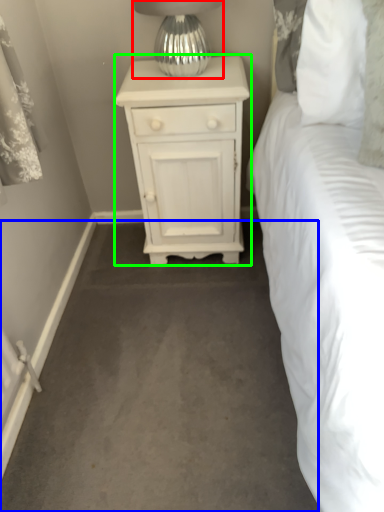
Question: Which object is the closest to the table lamp (highlighted by a red box)? Choose among these: concrete (highlighted by a blue box) or nightstand (highlighted by a green box).

Choices:
 (A) concrete
 (B) nightstand

Answer: (B)